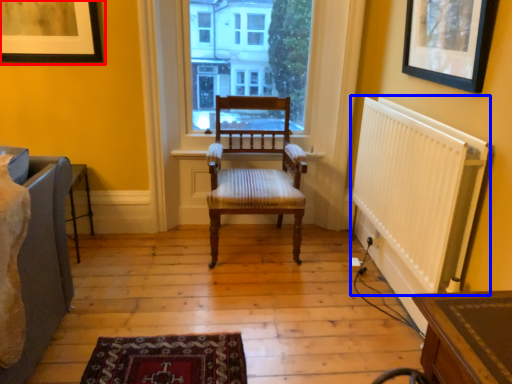
Question: Which object is closer to the camera taking this photo, picture frame (highlighted by a red box) or radiator (highlighted by a blue box)?

Choices:
 (A) picture frame
 (B) radiator

Answer: (B)